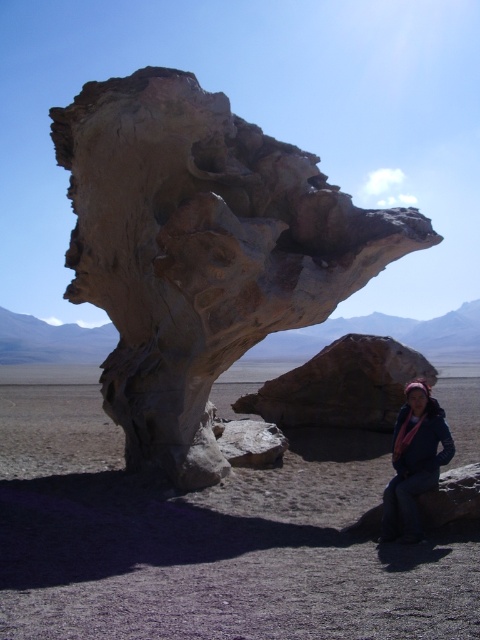
Is rustic stone sculpture at center taller than pink scarf at lower right?

Indeed, rustic stone sculpture at center has a greater height compared to pink scarf at lower right.

You are a GUI agent. You are given a task and a screenshot of the screen. Output one action in this format:
    pyautogui.click(x=<x>, y=<y>)
    Task: Click on the rustic stone sculpture at center
    Image resolution: width=480 pixels, height=640 pixels.
    Given the screenshot: What is the action you would take?
    pyautogui.click(x=201, y=250)